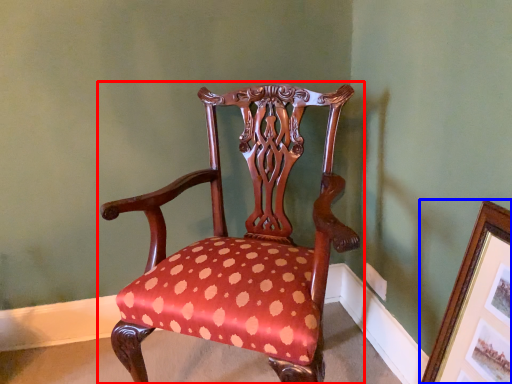
Question: Which object is closer to the camera taking this photo, chair (highlighted by a red box) or picture frame (highlighted by a blue box)?

Choices:
 (A) chair
 (B) picture frame

Answer: (B)